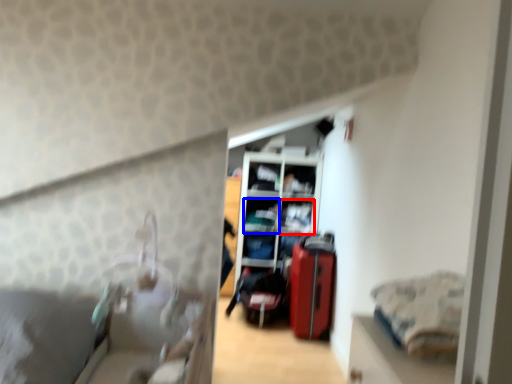
Question: Which object is closer to the camera taking this photo, shelf (highlighted by a red box) or shelf (highlighted by a blue box)?

Choices:
 (A) shelf
 (B) shelf

Answer: (A)